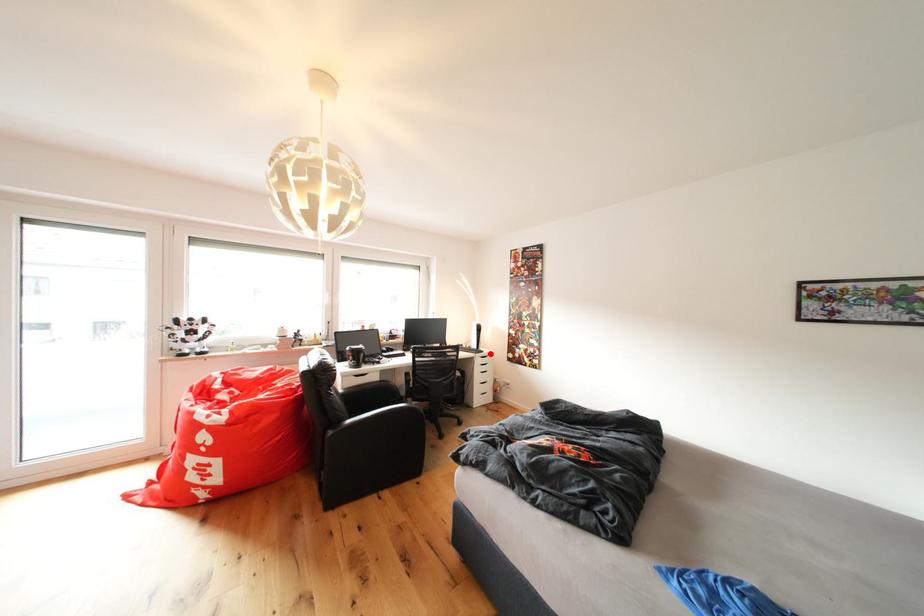
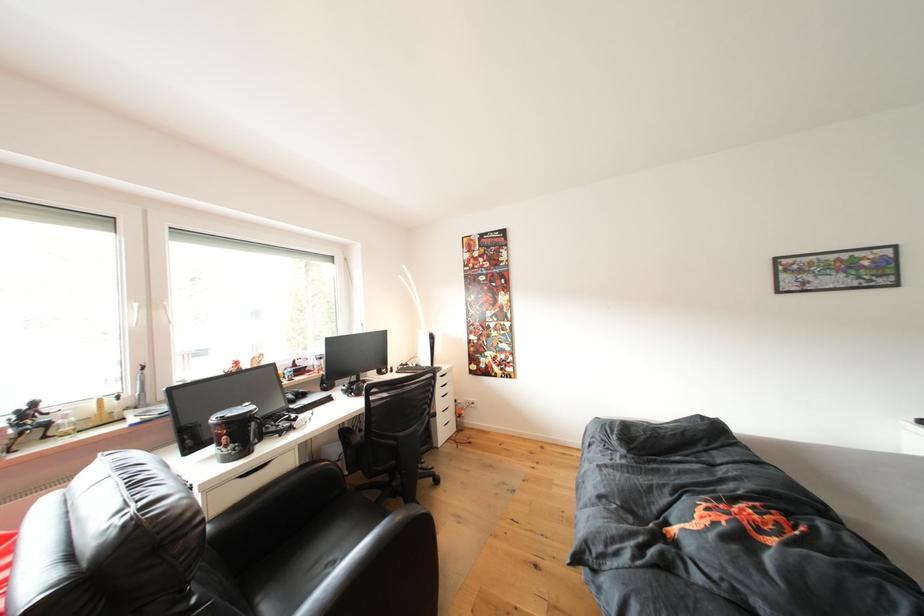
Locate, in the second image, the point that corresponds to the highlighted location in the first image.

(444, 370)